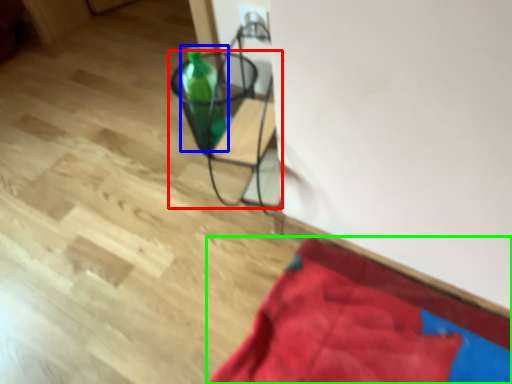
Question: Based on their relative distances, which object is nearer to furniture (highlighted by a red box)? Choose from bottle (highlighted by a blue box) and blanket (highlighted by a green box).

Choices:
 (A) bottle
 (B) blanket

Answer: (A)